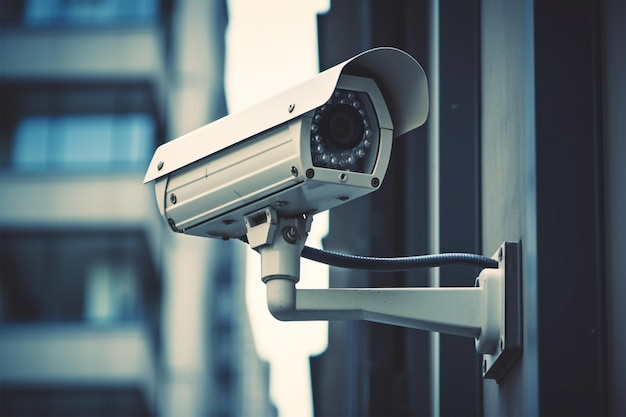
Where is `security camera`? security camera is located at coordinates (268, 159).